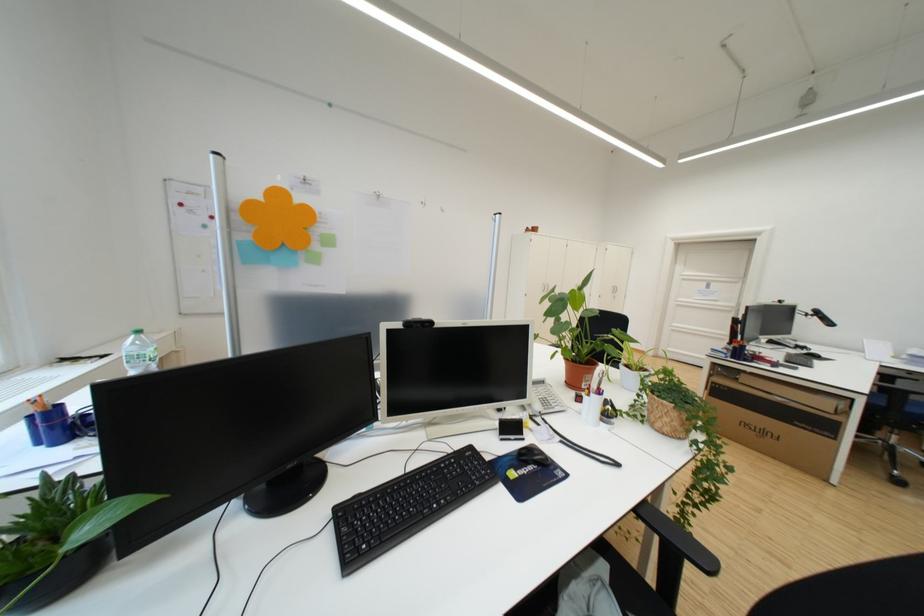
Locate an element on the screen. The height and width of the screenshot is (616, 924). silver cabinet handle is located at coordinates (614, 290).